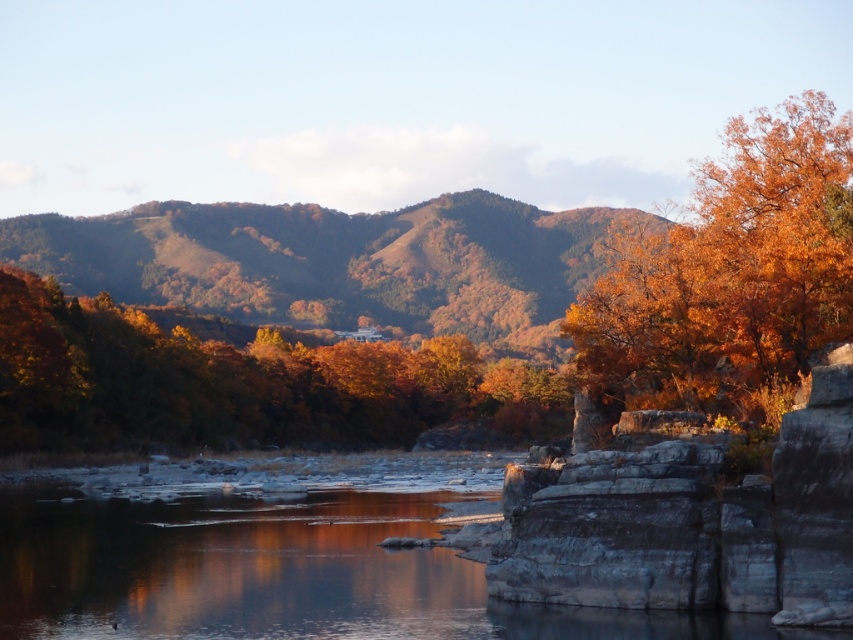
Question: Can you confirm if golden foliage tree at center is positioned below gray rocky cliff at right?

Choices:
 (A) no
 (B) yes

Answer: (B)

Question: Which is nearer to the golden foliage hill at center?

Choices:
 (A) golden foliage at center
 (B) golden foliage tree at center
 (C) gray rocky cliff at right
 (D) golden textured tree at right

Answer: (A)

Question: Does golden textured tree at right appear on the left side of gray rocky cliff at right?

Choices:
 (A) no
 (B) yes

Answer: (A)

Question: Is golden foliage at center wider than golden foliage tree at center?

Choices:
 (A) no
 (B) yes

Answer: (B)

Question: Which point is closer to the camera taking this photo?

Choices:
 (A) (535, 396)
 (B) (675, 529)
 (C) (109, 392)
 (D) (775, 358)

Answer: (B)

Question: Which object is the farthest from the golden foliage tree at center?

Choices:
 (A) golden foliage at center
 (B) gray rocky cliff at right
 (C) golden foliage hill at center

Answer: (B)